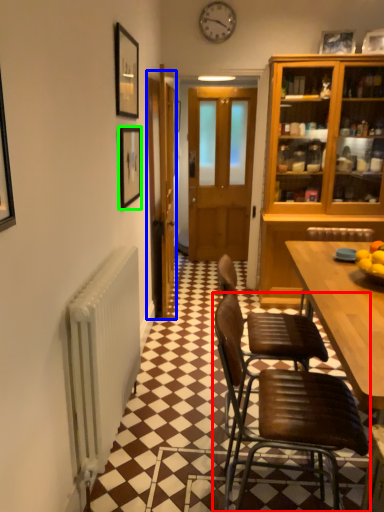
Question: Estimate the real-world distances between objects in this image. Which object is farther from chair (highlighted by a red box), door (highlighted by a blue box) or picture frame (highlighted by a green box)?

Choices:
 (A) door
 (B) picture frame

Answer: (A)